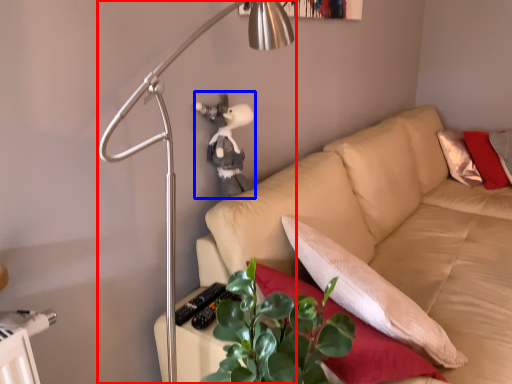
Question: Which of the following is the closest to the observer, lamp (highlighted by a red box) or figurine (highlighted by a blue box)?

Choices:
 (A) lamp
 (B) figurine

Answer: (A)